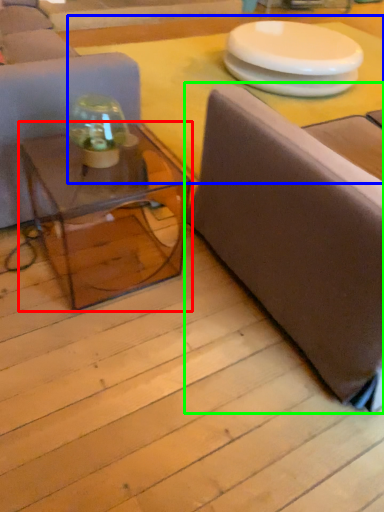
Question: Which object is positioned farthest from coffee table (highlighted by a red box)? Select from table top (highlighted by a blue box) and studio couch (highlighted by a green box).

Choices:
 (A) table top
 (B) studio couch

Answer: (A)